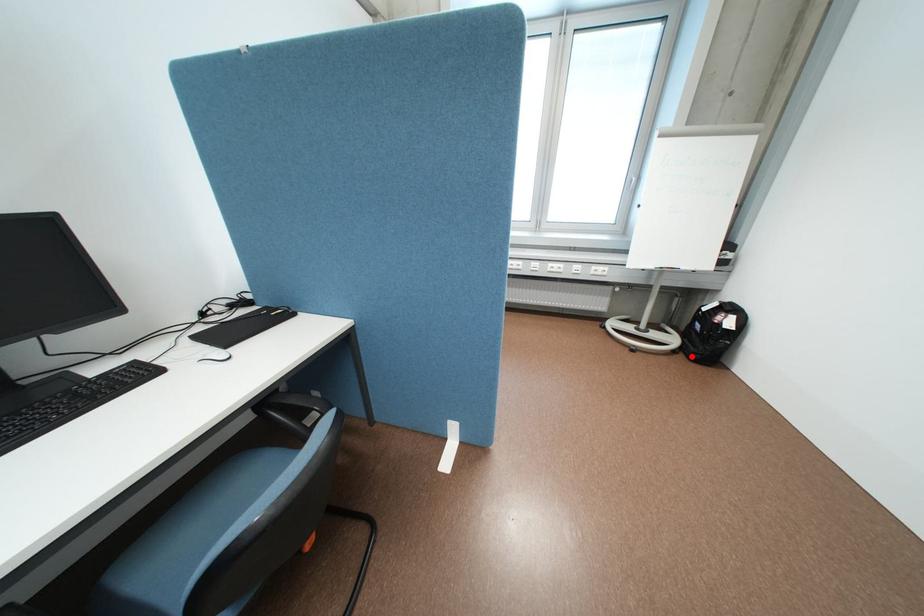
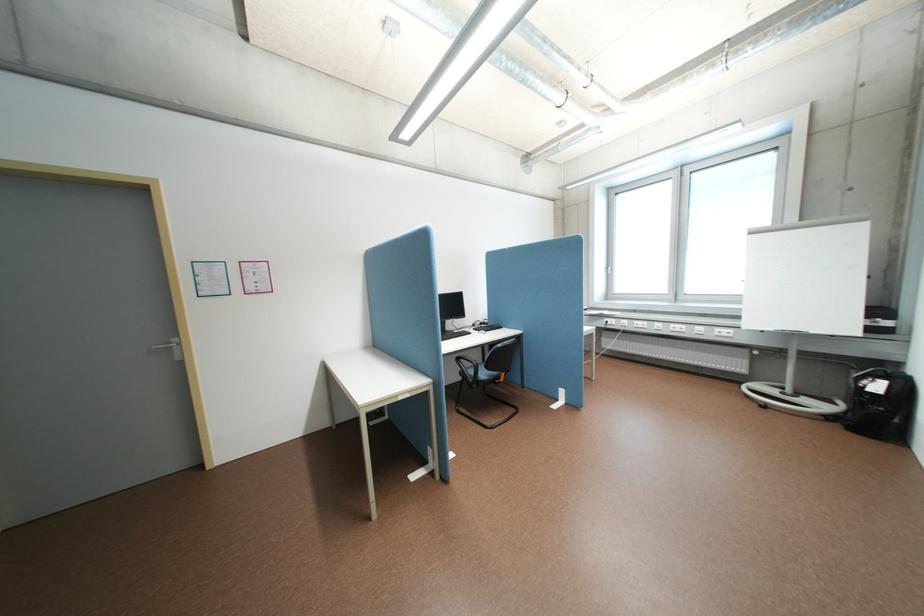
Question: A red point is marked in image1. In image2, is the corresponding 3D point closer to the camera or farther? Reply with the corresponding letter.

Choices:
 (A) The corresponding 3D point is closer.
 (B) The corresponding 3D point is farther.

Answer: (A)